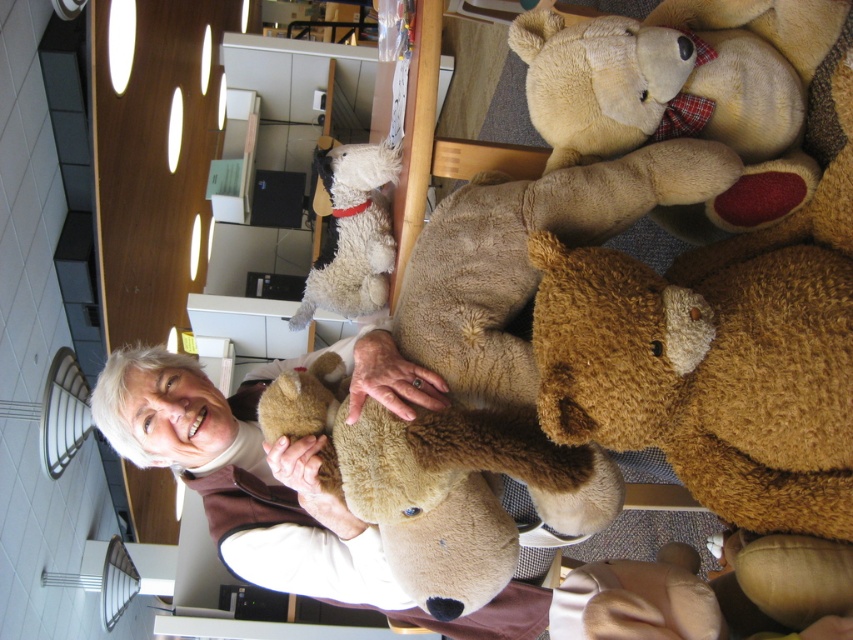
Question: Which object appears farthest from the camera in this image?

Choices:
 (A) fuzzy beige dog at upper center
 (B) brown plush teddy bear at center
 (C) soft beige teddy bear at upper right

Answer: (A)

Question: Is soft beige teddy bear at upper right further to camera compared to fuzzy beige dog at upper center?

Choices:
 (A) no
 (B) yes

Answer: (A)

Question: Among these points, which one is farthest from the camera?

Choices:
 (A) (357, 202)
 (B) (555, 124)
 (C) (648, 408)

Answer: (A)

Question: Is brown plush teddy bear at center positioned behind soft beige teddy bear at upper right?

Choices:
 (A) no
 (B) yes

Answer: (A)

Question: Can you confirm if brown plush teddy bear at center is smaller than fuzzy beige dog at upper center?

Choices:
 (A) no
 (B) yes

Answer: (A)

Question: Based on their relative distances, which object is nearer to the brown plush teddy bear at center?

Choices:
 (A) fuzzy beige dog at upper center
 (B) soft beige teddy bear at upper right

Answer: (B)